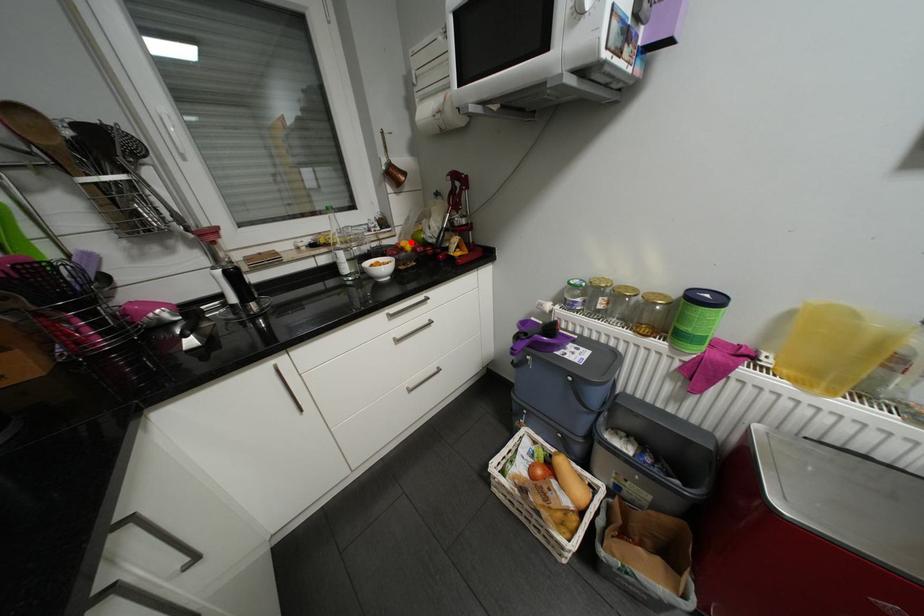
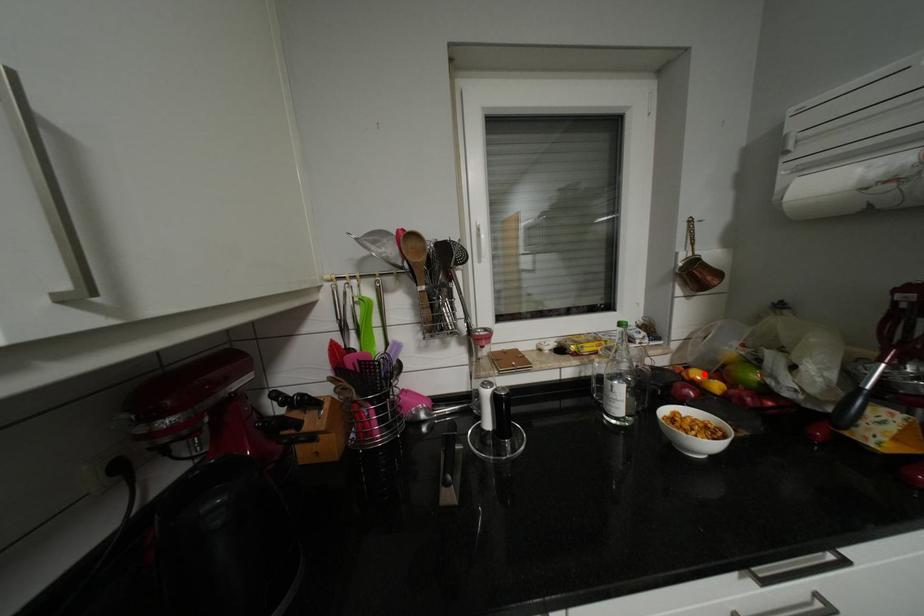
I am providing you with two images of the same scene from different viewpoints. A red point is marked on the first image and another point is marked on the second image. Does the point marked in image1 correspond to the same location as the one in image2?

Yes